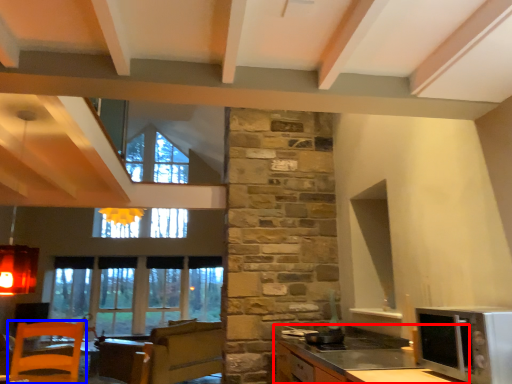
Question: Among these objects, which one is nearest to the camera, cabinetry (highlighted by a red box) or chair (highlighted by a blue box)?

Choices:
 (A) cabinetry
 (B) chair

Answer: (A)